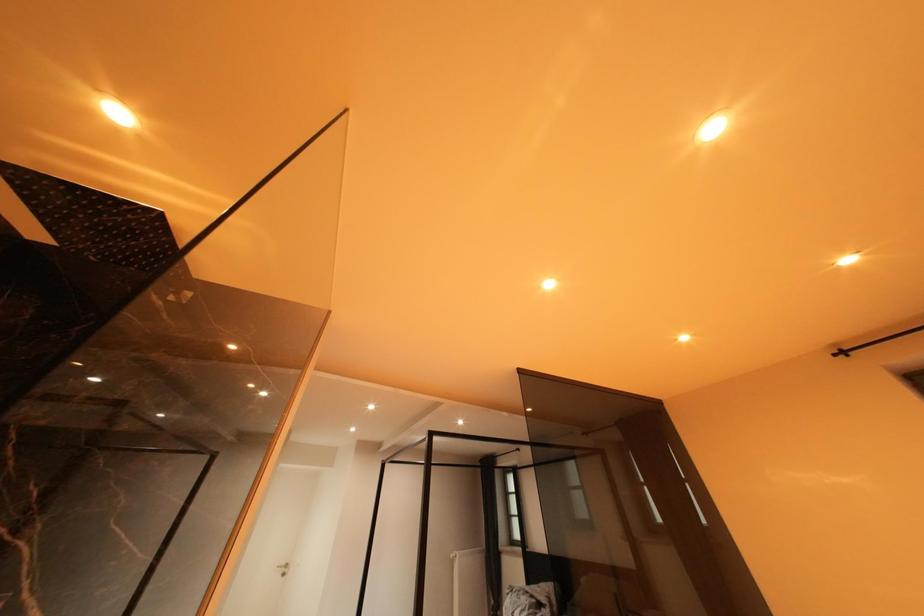
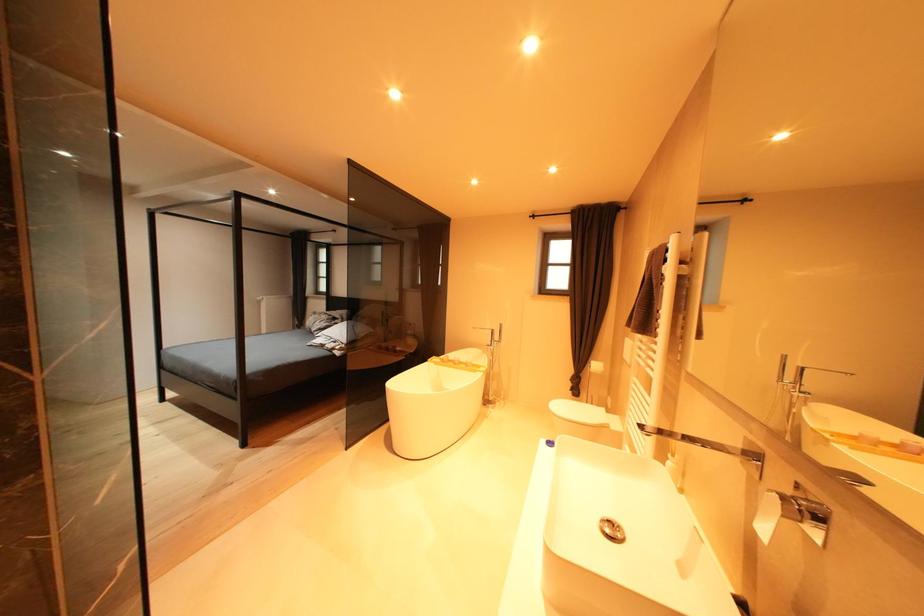
The images are taken continuously from a first-person perspective. In which direction is your viewpoint rotating?

The camera rotated toward right-down.